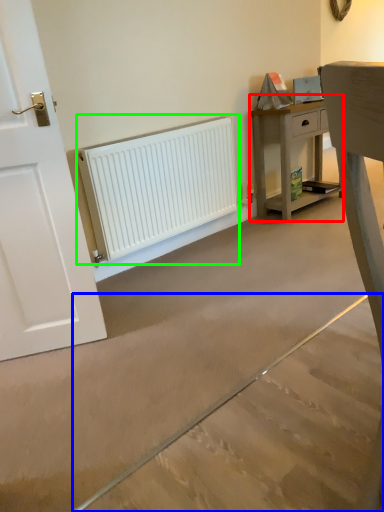
Question: Estimate the real-world distances between objects in this image. Which object is farther from nightstand (highlighted by a red box), concrete (highlighted by a blue box) or radiator (highlighted by a green box)?

Choices:
 (A) concrete
 (B) radiator

Answer: (A)